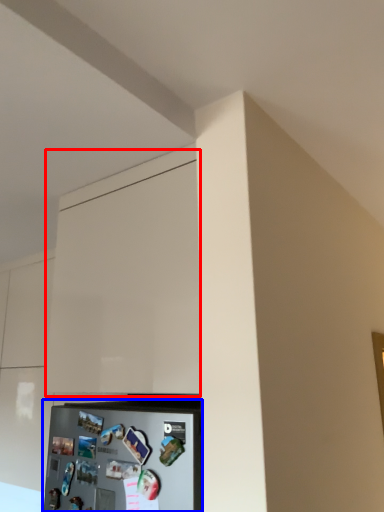
Question: Which of the following is the closest to the observer, cabinetry (highlighted by a red box) or appliance (highlighted by a blue box)?

Choices:
 (A) cabinetry
 (B) appliance

Answer: (B)